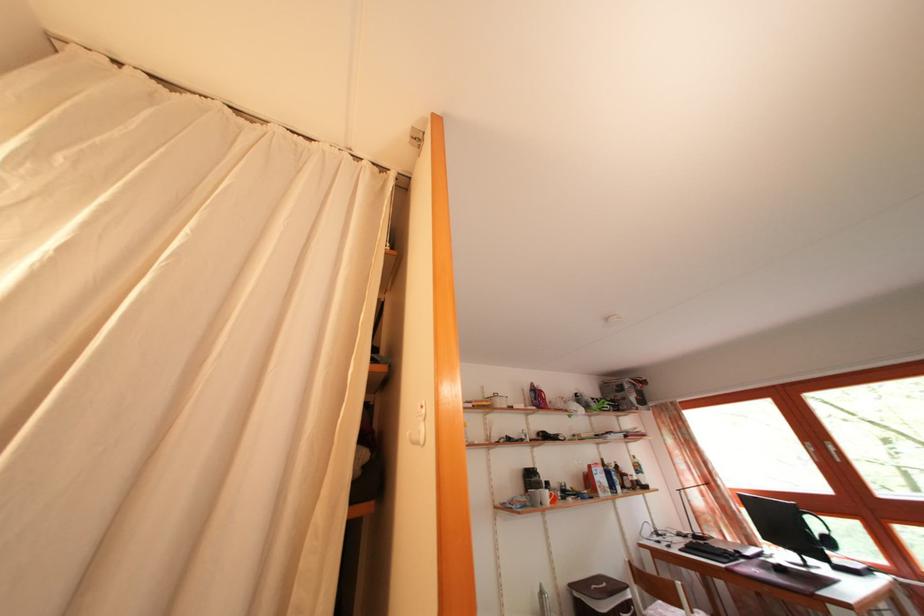
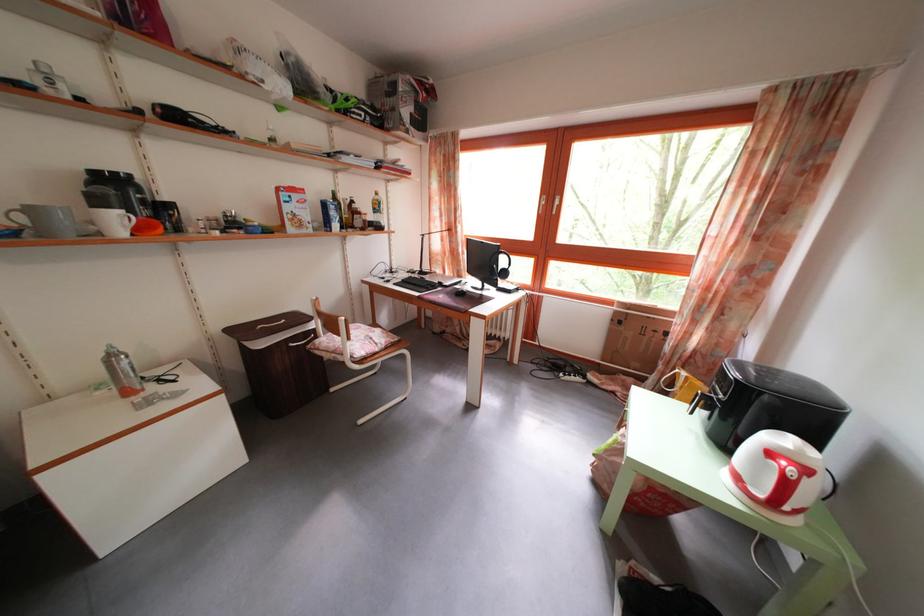
The point at (757,565) is marked in the first image. Where is the corresponding point in the second image?

(454, 294)